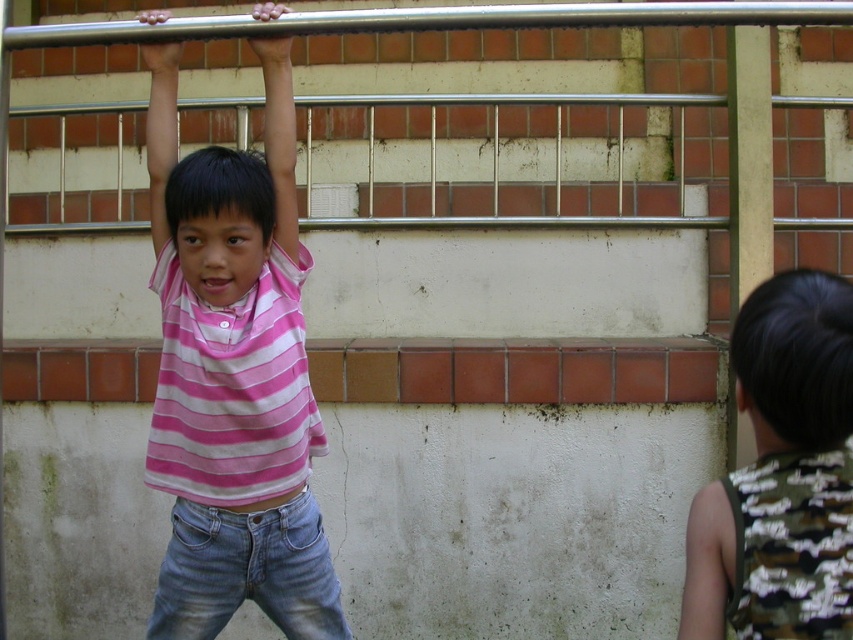
Which is more to the right, pink striped shirt at center or denim jeans at lower center?

Positioned to the right is denim jeans at lower center.

Is pink striped shirt at center shorter than denim jeans at lower center?

In fact, pink striped shirt at center may be taller than denim jeans at lower center.

The image size is (853, 640). What are the coordinates of `pink striped shirt at center` in the screenshot? It's located at (233, 376).

You are a GUI agent. You are given a task and a screenshot of the screen. Output one action in this format:
    pyautogui.click(x=<x>, y=<y>)
    Task: Click on the pink striped shirt at center
    The height and width of the screenshot is (640, 853).
    Given the screenshot: What is the action you would take?
    pyautogui.click(x=233, y=376)

Where is `pink striped shirt at center`? pink striped shirt at center is located at coordinates (233, 376).

Is camouflage fabric shirt at right in front of denim jeans at lower center?

Yes, it is in front of denim jeans at lower center.

Does point (766, 435) lie behind point (222, 538)?

No, it is not.

This screenshot has width=853, height=640. What are the coordinates of `camouflage fabric shirt at right` in the screenshot? It's located at (781, 474).